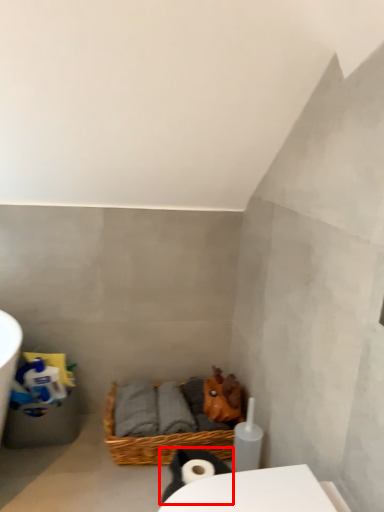
Question: Considering the relative positions of animal (annotated by the red box) and basket in the image provided, where is animal (annotated by the red box) located with respect to the staircase?

Choices:
 (A) right
 (B) left

Answer: (A)